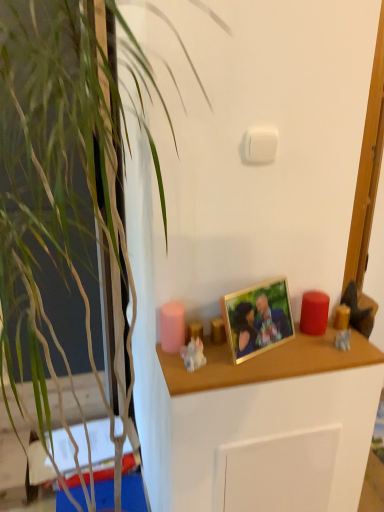
Find the location of `free space to the left of red matte candle at right, the second candle viewed from the left`. free space to the left of red matte candle at right, the second candle viewed from the left is located at coordinates (270, 344).